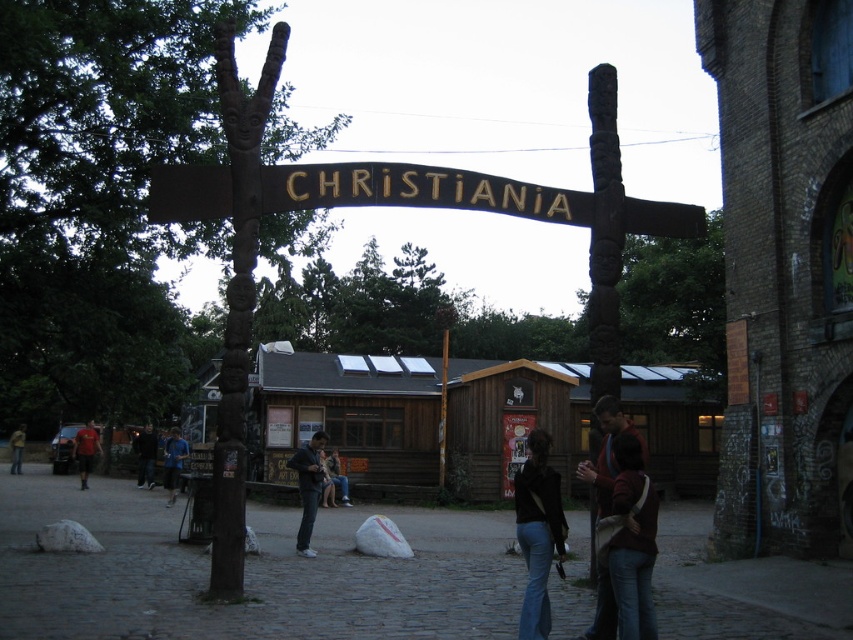
Question: Can you confirm if blue fabric shirt at lower left is bigger than matte red shirt at center?

Choices:
 (A) no
 (B) yes

Answer: (A)

Question: Can you confirm if wooden sign at center is wider than denim jacket at center?

Choices:
 (A) no
 (B) yes

Answer: (B)

Question: Is dark blue jeans at lower left closer to the viewer compared to denim jacket at center?

Choices:
 (A) no
 (B) yes

Answer: (A)

Question: Which point is closer to the camera taking this photo?

Choices:
 (A) (531, 628)
 (B) (294, 461)
 (C) (622, 451)

Answer: (A)

Question: Which point appears closest to the camera in this image?

Choices:
 (A) (151, 476)
 (B) (78, 449)

Answer: (A)

Question: Considering the real-world distances, which object is farthest from the yellow fabric jacket at lower left?

Choices:
 (A) dark blue jeans at lower left
 (B) matte red shirt at center
 (C) denim jeans at lower center

Answer: (C)